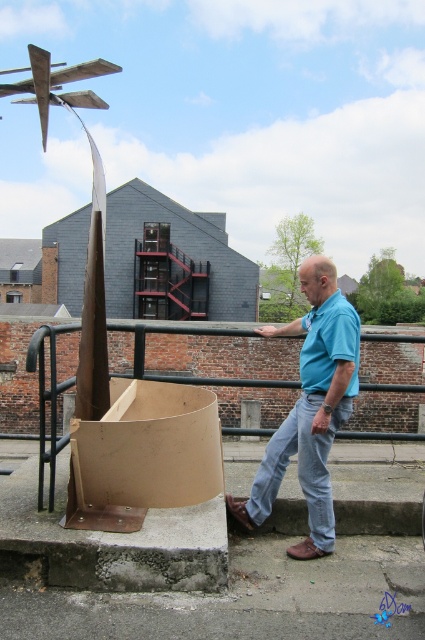
Which is more to the left, blue cotton shirt at center or light blue denim jeans at lower center?

From the viewer's perspective, light blue denim jeans at lower center appears more on the left side.

Does blue cotton shirt at center have a greater height compared to light blue denim jeans at lower center?

Yes, blue cotton shirt at center is taller than light blue denim jeans at lower center.

Who is more distant from viewer, (328, 266) or (306, 484)?

The point (306, 484) is more distant.

You are a GUI agent. You are given a task and a screenshot of the screen. Output one action in this format:
    pyautogui.click(x=<x>, y=<y>)
    Task: Click on the blue cotton shirt at center
    Image resolution: width=425 pixels, height=640 pixels.
    Given the screenshot: What is the action you would take?
    pyautogui.click(x=311, y=410)

Is brown metal rail at center taller than light blue denim jeans at lower center?

Yes.

Does brown metal rail at center have a lesser width compared to light blue denim jeans at lower center?

No.

Who is more distant from viewer, (214, 333) or (282, 456)?

The point (214, 333) is more distant.

Where is `brown metal rail at center`? This screenshot has height=640, width=425. brown metal rail at center is located at coordinates (187, 336).

Is blue cotton shirt at center bigger than brown metal rail at center?

No.

Who is more forward, (320, 369) or (408, 339)?

Positioned in front is point (320, 369).

The height and width of the screenshot is (640, 425). What do you see at coordinates (311, 410) in the screenshot?
I see `blue cotton shirt at center` at bounding box center [311, 410].

What are the coordinates of `blue cotton shirt at center` in the screenshot? It's located at (311, 410).